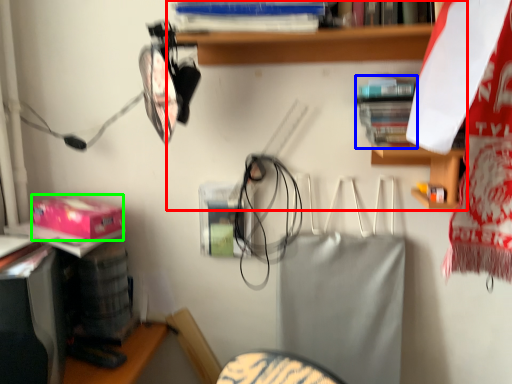
Question: Which object is the closest to the shelf (highlighted by a red box)? Choose among these: book (highlighted by a blue box) or box (highlighted by a green box).

Choices:
 (A) book
 (B) box

Answer: (A)